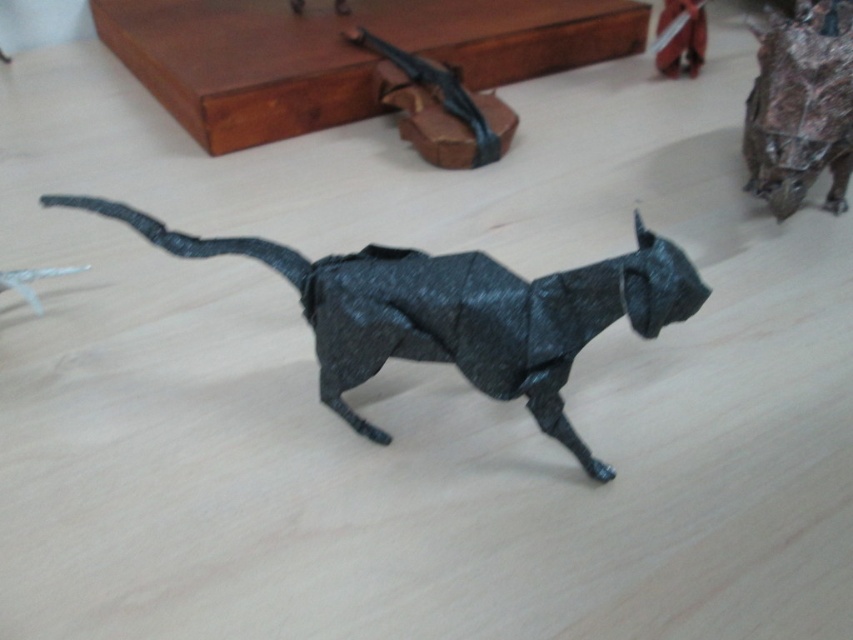
Is point (517, 116) in front of point (670, 6)?

Yes, point (517, 116) is closer to viewer.

Can you confirm if matte black origami cat at upper center is smaller than metallic silver sword at upper right?

No, matte black origami cat at upper center is not smaller than metallic silver sword at upper right.

Is point (485, 156) farther from camera compared to point (677, 38)?

That is False.

The width and height of the screenshot is (853, 640). I want to click on matte black origami cat at upper center, so click(438, 106).

The width and height of the screenshot is (853, 640). What are the coordinates of `rustic brown paper bag at upper right` in the screenshot? It's located at (799, 106).

Does rustic brown paper bag at upper right have a greater height compared to matte black origami cat at upper center?

Correct, rustic brown paper bag at upper right is much taller as matte black origami cat at upper center.

Between point (798, 74) and point (432, 147), which one is positioned behind?

The point (432, 147) is more distant.

Identify the location of rustic brown paper bag at upper right. The height and width of the screenshot is (640, 853). (799, 106).

Is the position of rustic brown paper bag at upper right less distant than that of metallic silver sword at upper right?

Yes, rustic brown paper bag at upper right is closer to the viewer.

In the scene shown: Does rustic brown paper bag at upper right have a greater width compared to metallic silver sword at upper right?

Yes.

Between point (786, 182) and point (688, 67), which one is positioned in front?

Point (786, 182)

Identify the location of rustic brown paper bag at upper right. This screenshot has height=640, width=853. (799, 106).